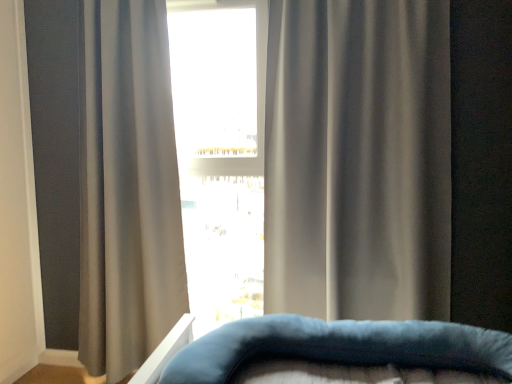
Question: Is satin gray curtain at center, which ranks as the second curtain in left-to-right order, bigger or smaller than velvety blue pillow at center?

Choices:
 (A) small
 (B) big

Answer: (B)

Question: In the image, is satin gray curtain at center, which ranks as the second curtain in left-to-right order, on the left side or the right side of velvety blue pillow at center?

Choices:
 (A) left
 (B) right

Answer: (B)

Question: Estimate the real-world distances between objects in this image. Which object is farther from the white glossy window at center?

Choices:
 (A) gray matte curtain at center, the 2th curtain viewed from the right
 (B) velvety blue pillow at center
 (C) satin gray curtain at center, placed as the first curtain when sorted from right to left

Answer: (B)

Question: Estimate the real-world distances between objects in this image. Which object is closer to the velvety blue pillow at center?

Choices:
 (A) satin gray curtain at center, which ranks as the second curtain in left-to-right order
 (B) gray matte curtain at center, placed as the 1th curtain when sorted from left to right
 (C) white glossy window at center

Answer: (A)